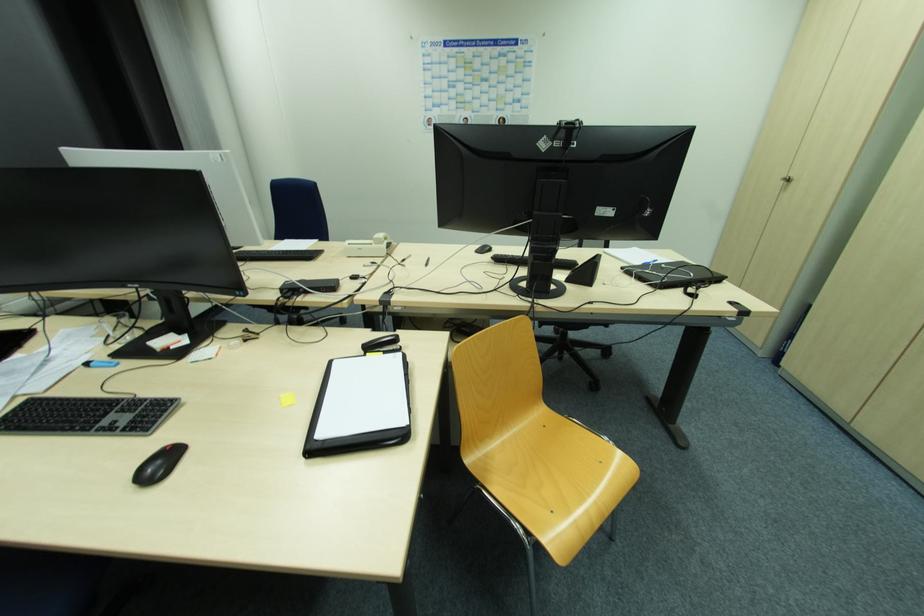
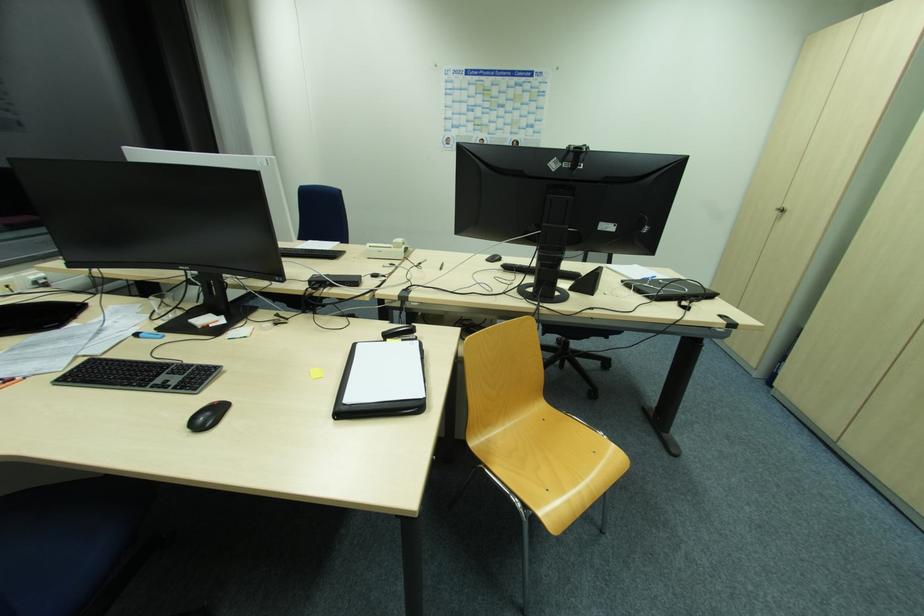
Question: I am providing you with two images of the same scene from different viewpoints. Please identify which objects are invisible in image2.

Choices:
 (A) silver cabinet lock
 (B) white telephone handset
 (C) black computer mouse
 (D) none of these

Answer: (D)